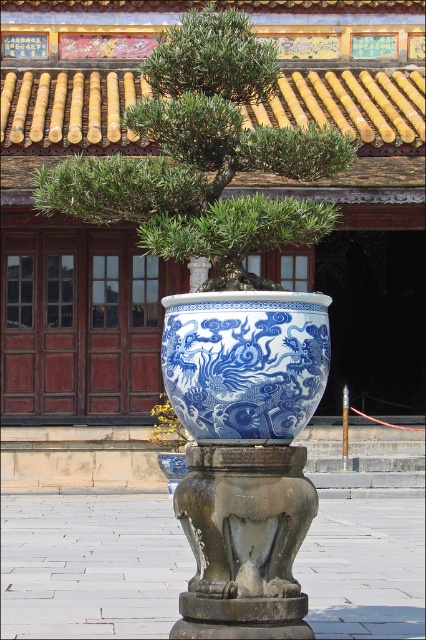
Who is more distant from viewer, [245,156] or [213,316]?

The point [245,156] is more distant.

Which of these two, green leafy tree at center or blue porcelain vase at center, stands shorter?

With less height is green leafy tree at center.

The image size is (426, 640). What do you see at coordinates (204, 156) in the screenshot? I see `green leafy tree at center` at bounding box center [204, 156].

At what (x,y) coordinates should I click in order to perform the action: click on green leafy tree at center. Please return your answer as a coordinate pair (x, y). Looking at the image, I should click on click(204, 156).